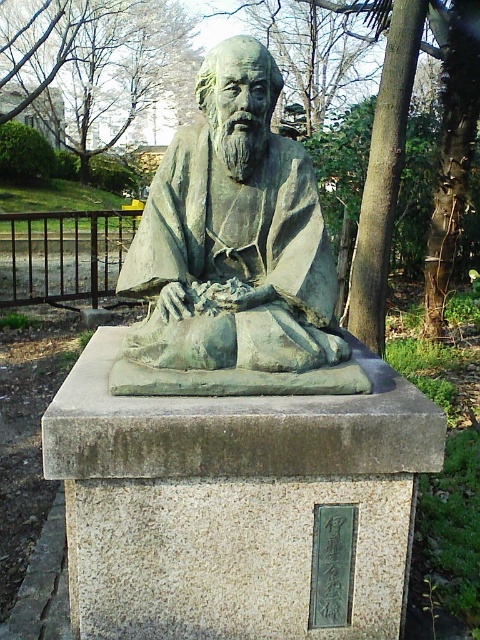
Measure the distance between green patina statue at center and camera.

green patina statue at center and camera are 7.89 feet apart from each other.

Is green patina statue at center closer to camera compared to green leafy tree at upper left?

Yes, it is in front of green leafy tree at upper left.

The image size is (480, 640). Identify the location of green patina statue at center. (233, 252).